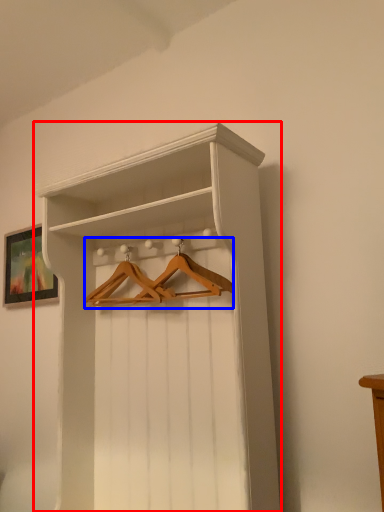
Question: Among these objects, which one is nearest to the camera, shelf (highlighted by a red box) or hanger (highlighted by a blue box)?

Choices:
 (A) shelf
 (B) hanger

Answer: (A)